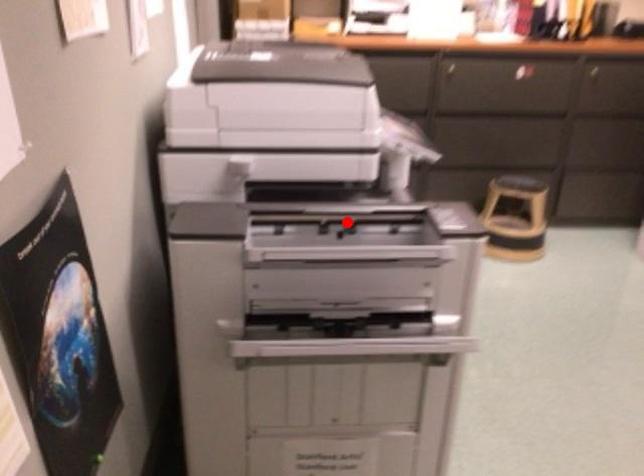
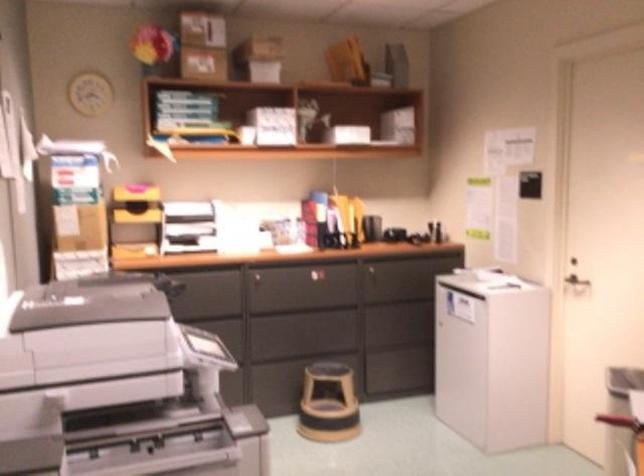
Where in the second image is the point corresponding to the highlighted location from the first image?

(133, 429)